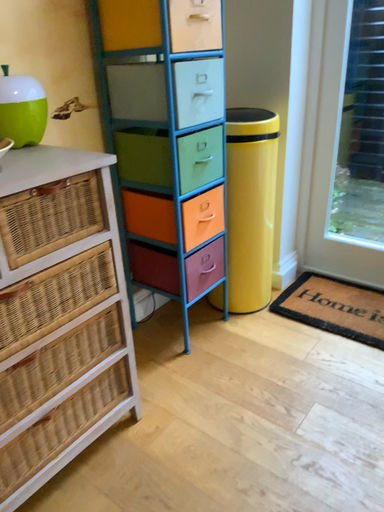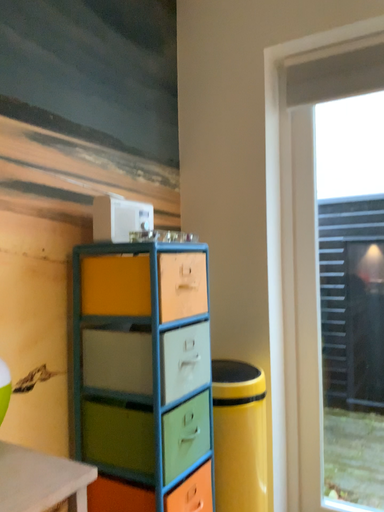
Question: How did the camera likely rotate when shooting the video?

Choices:
 (A) rotated left
 (B) rotated right

Answer: (B)